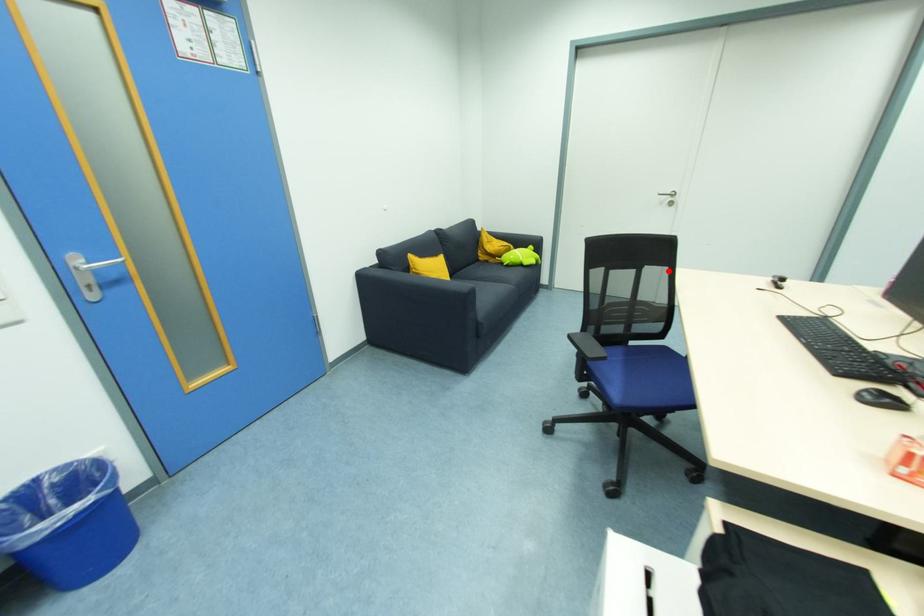
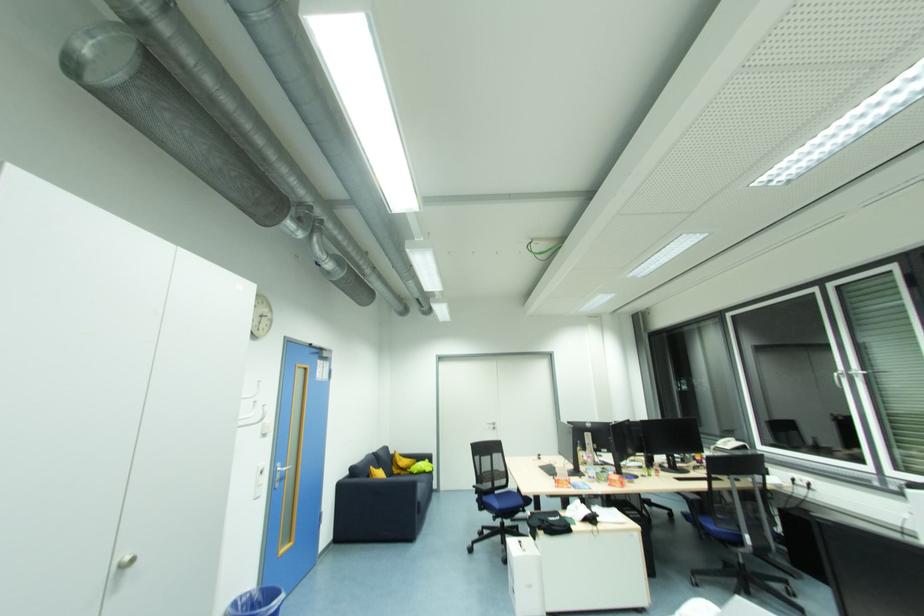
Find the pixel in the second image that matches the highlighted location in the first image.

(504, 456)